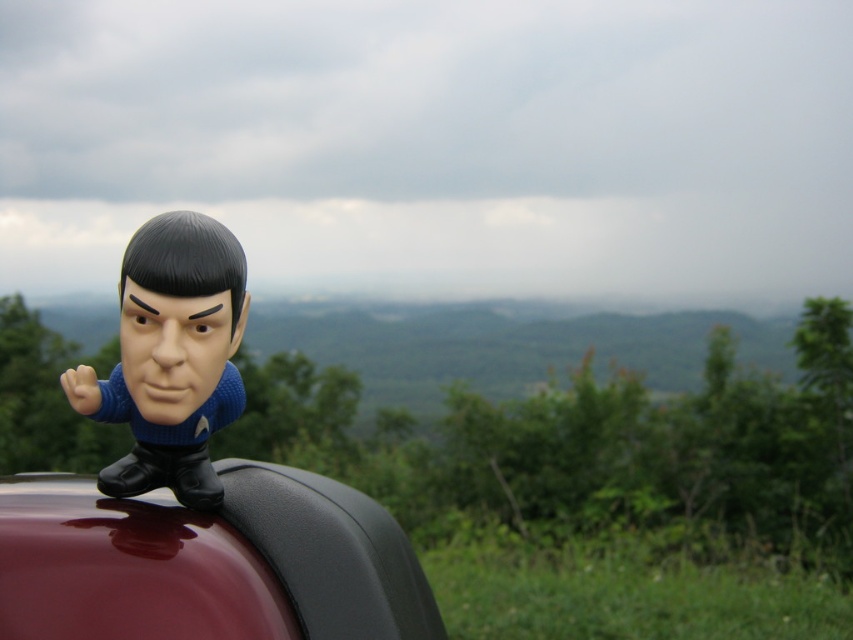
Can you confirm if glossy black car at upper center is smaller than matte black bobblehead at upper left?

Actually, glossy black car at upper center might be larger than matte black bobblehead at upper left.

Which is more to the right, glossy black car at upper center or matte black bobblehead at upper left?

From the viewer's perspective, matte black bobblehead at upper left appears more on the right side.

Which is in front, point (308, 598) or point (167, 401)?

Point (167, 401) is in front.

This screenshot has width=853, height=640. In order to click on glossy black car at upper center in this screenshot , I will do `click(207, 563)`.